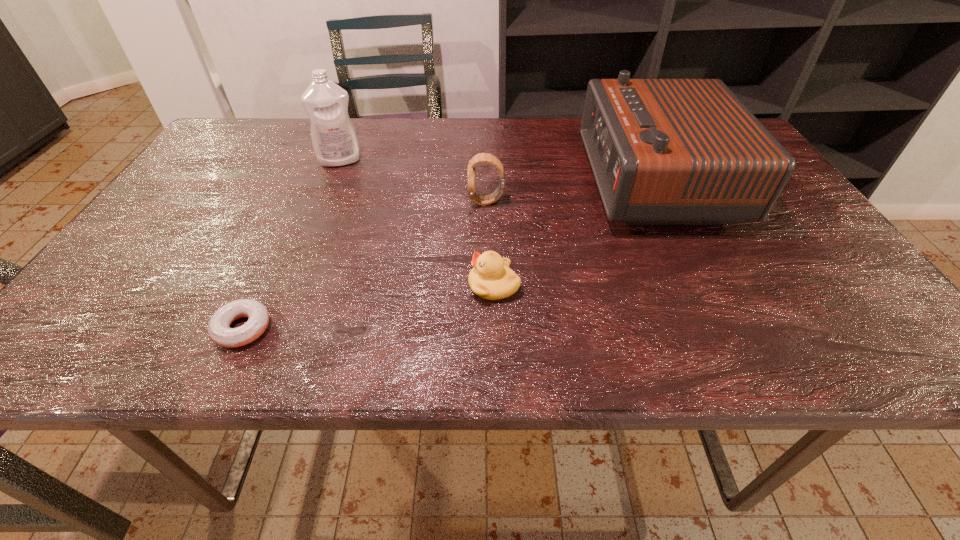
This screenshot has height=540, width=960. I want to click on vacant space that is in between the detergent and the rightmost object, so [497, 172].

Where is `empty space that is in between the radio receiver and the detergent`? empty space that is in between the radio receiver and the detergent is located at coordinates (497, 172).

What are the coordinates of `free area in between the fourth tallest object and the shortest object` in the screenshot? It's located at (369, 307).

Locate an element on the screen. This screenshot has width=960, height=540. free spot between the rightmost object and the third shortest object is located at coordinates (570, 192).

Image resolution: width=960 pixels, height=540 pixels. Find the location of `free space between the second shortest object and the detergent`. free space between the second shortest object and the detergent is located at coordinates (417, 223).

This screenshot has width=960, height=540. In order to click on vacant area that lies between the doughnut and the rightmost object in this screenshot , I will do [448, 255].

Identify the location of empty location between the rightmost object and the third shortest object. The width and height of the screenshot is (960, 540). (570, 192).

Locate an element on the screen. This screenshot has height=540, width=960. free space between the detergent and the third shortest object is located at coordinates (413, 181).

Identify the location of object that is the nearest to the detergent. Image resolution: width=960 pixels, height=540 pixels. (481, 157).

You are a GUI agent. You are given a task and a screenshot of the screen. Output one action in this format:
    pyautogui.click(x=<x>, y=<y>)
    Task: Click on the third closest object to the fourth tallest object
    
    Given the screenshot: What is the action you would take?
    pyautogui.click(x=219, y=330)